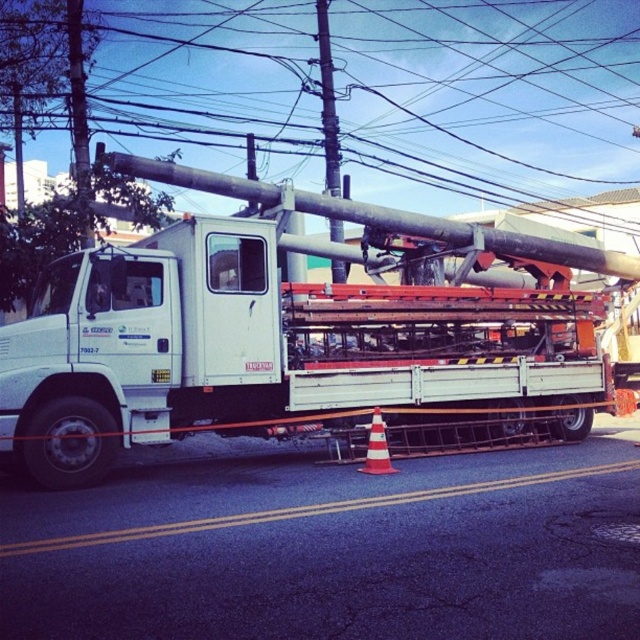
Which of these two, brushed metal pole at center or orange reflective traffic cone at lower center, stands shorter?

With less height is orange reflective traffic cone at lower center.

Identify the location of brushed metal pole at center. This screenshot has height=640, width=640. (326, 102).

You are a GUI agent. You are given a task and a screenshot of the screen. Output one action in this format:
    pyautogui.click(x=<x>, y=<y>)
    Task: Click on the brushed metal pole at center
    This screenshot has height=640, width=640.
    Given the screenshot: What is the action you would take?
    (326, 102)

Does white matte trailer truck at center appear on the right side of brushed metal pole at center?

Correct, you'll find white matte trailer truck at center to the right of brushed metal pole at center.

From the picture: Does white matte trailer truck at center have a larger size compared to brushed metal pole at center?

Yes, white matte trailer truck at center is bigger than brushed metal pole at center.

Is point (173, 387) positioned after point (320, 61)?

That is False.

The width and height of the screenshot is (640, 640). I want to click on white matte trailer truck at center, so click(288, 342).

Does white matte trailer truck at center have a greater width compared to orange reflective traffic cone at lower center?

Indeed, white matte trailer truck at center has a greater width compared to orange reflective traffic cone at lower center.

Looking at this image, who is higher up, white matte trailer truck at center or orange reflective traffic cone at lower center?

white matte trailer truck at center is above.

The height and width of the screenshot is (640, 640). I want to click on white matte trailer truck at center, so click(x=288, y=342).